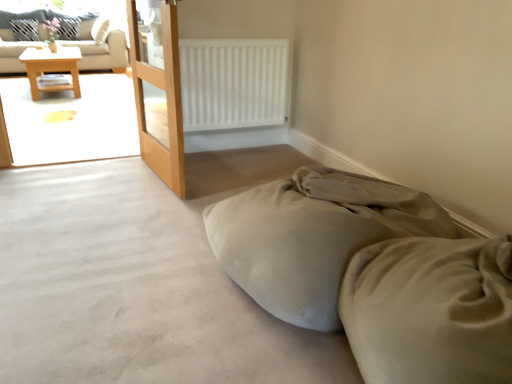
Identify the location of blank space situated above white matte radiator at upper center (from a real-world perspective). (225, 33).